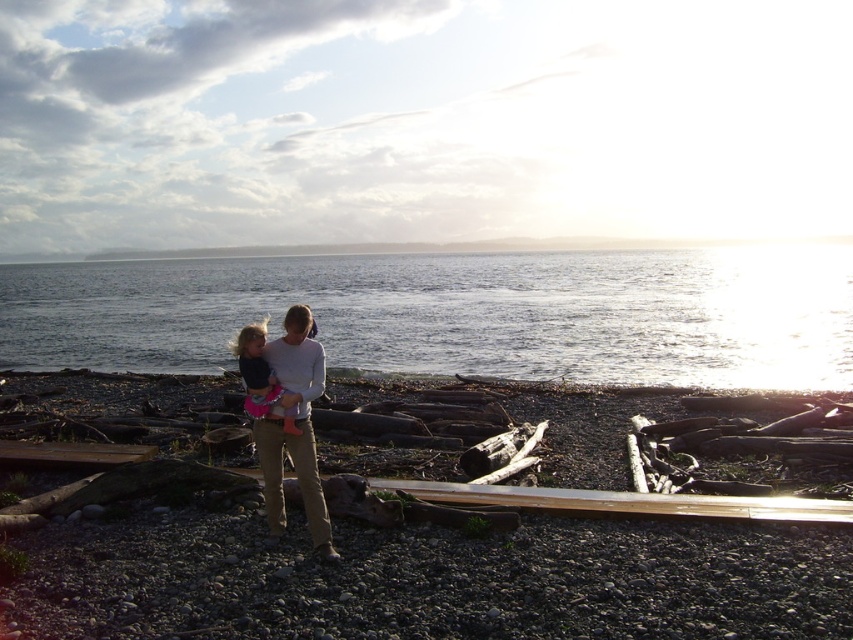
Between point (770, 387) and point (252, 413), which one is positioned behind?

Point (770, 387)

Which is in front, point (650, 259) or point (245, 368)?

Point (245, 368)

The image size is (853, 640). Describe the element at coordinates (459, 314) in the screenshot. I see `clear water at center` at that location.

Locate an element on the screen. clear water at center is located at coordinates (459, 314).

Who is more distant from viewer, (120,560) or (422,340)?

The point (422,340) is behind.

Does smooth gravel beach at center have a greater height compared to clear water at center?

No.

The height and width of the screenshot is (640, 853). Identify the location of smooth gravel beach at center. (428, 577).

Is light gray cotton sweater at center smaller than matte pink skirt at center?

Correct, light gray cotton sweater at center occupies less space than matte pink skirt at center.

Is point (268, 381) in front of point (254, 403)?

No, (268, 381) is behind (254, 403).

Locate an element on the screen. The width and height of the screenshot is (853, 640). light gray cotton sweater at center is located at coordinates (286, 417).